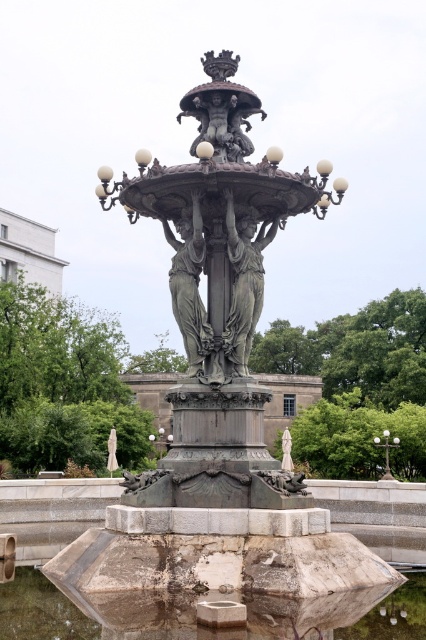
Measure the distance between white marble statue at center and camera.

The distance of white marble statue at center from camera is 81.74 meters.

Does white marble statue at center appear over matte bronze lamp post at center?

Correct, white marble statue at center is located above matte bronze lamp post at center.

Is point (287, 467) positioned after point (169, 440)?

No, it is in front of (169, 440).

Where is `white marble statue at center`? This screenshot has width=426, height=640. white marble statue at center is located at coordinates (287, 451).

Who is positioned more to the right, bronze statue at center or green metal/bronze streetlight at center?

green metal/bronze streetlight at center

Who is lower down, bronze statue at center or green metal/bronze streetlight at center?

green metal/bronze streetlight at center

The height and width of the screenshot is (640, 426). Identify the location of bronze statue at center. (244, 284).

Which is behind, point (39, 582) or point (238, 285)?

The point (238, 285) is more distant.

Where is `translucent stone water at lower center`? translucent stone water at lower center is located at coordinates (40, 611).